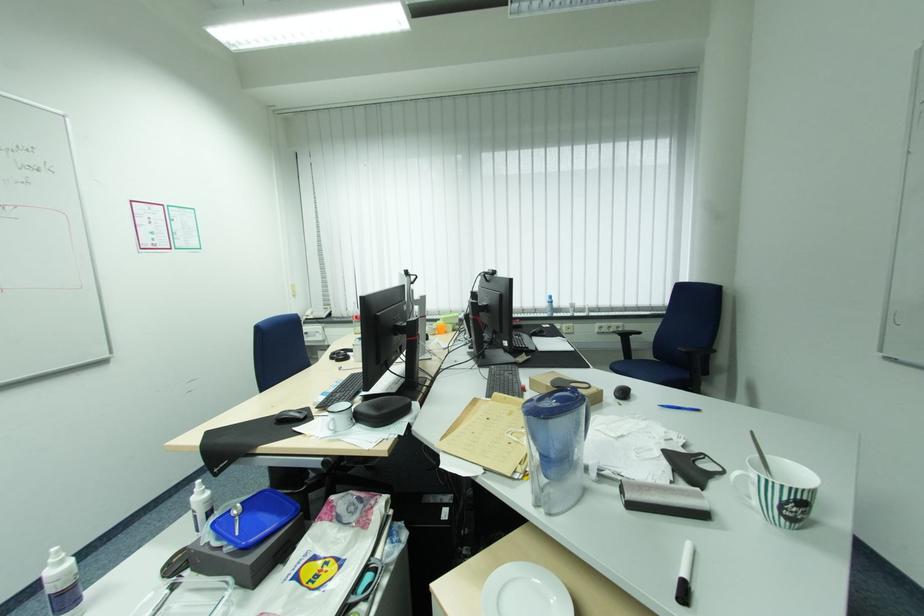
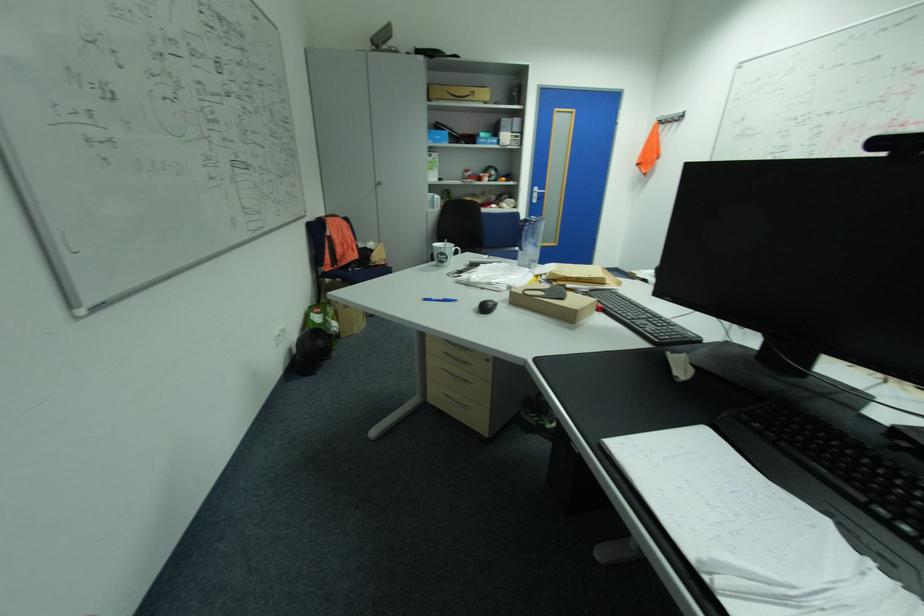
Question: I am providing you with two images of the same scene from different viewpoints. After the viewpoint changes to image2, which objects are now occluded?

Choices:
 (A) white spray bottle
 (B) blue pen
 (C) silver door handle
 (D) yellow neck pillow

Answer: (A)